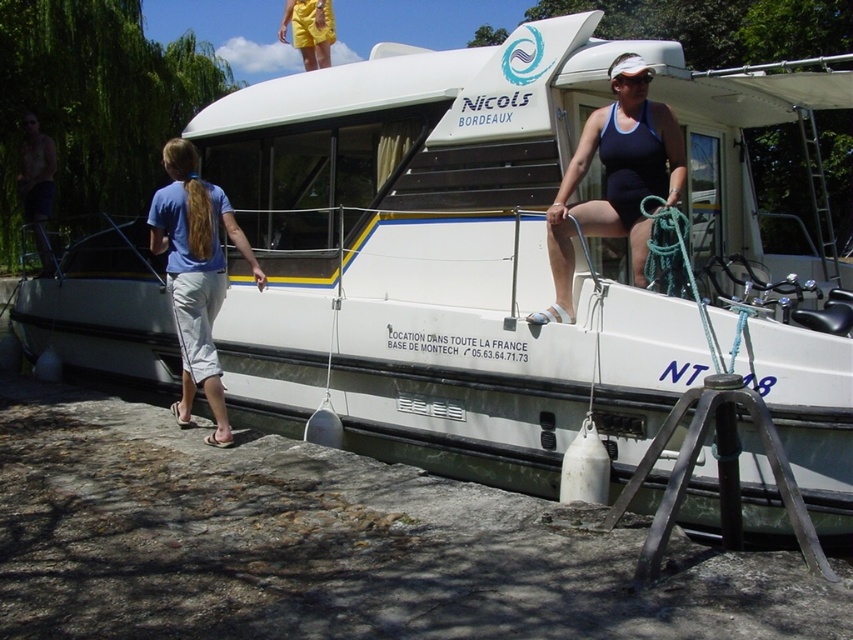
Question: Can you confirm if blue cotton shirt at left is positioned below shiny metallic pole at left?

Choices:
 (A) no
 (B) yes

Answer: (B)

Question: Observing the image, what is the correct spatial positioning of dark blue swimsuit at upper right in reference to blue cotton shirt at left?

Choices:
 (A) left
 (B) right

Answer: (B)

Question: Which is nearer to the shiny metallic pole at left?

Choices:
 (A) dark blue swimsuit at upper right
 (B) blue cotton shirt at left

Answer: (B)

Question: Which point is farther to the camera?

Choices:
 (A) shiny metallic pole at left
 (B) blue cotton shirt at left

Answer: (A)

Question: Considering the relative positions of dark blue swimsuit at upper right and blue cotton shirt at left in the image provided, where is dark blue swimsuit at upper right located with respect to blue cotton shirt at left?

Choices:
 (A) right
 (B) left

Answer: (A)

Question: Based on their relative distances, which object is nearer to the shiny metallic pole at left?

Choices:
 (A) blue cotton shirt at left
 (B) dark blue swimsuit at upper right

Answer: (A)